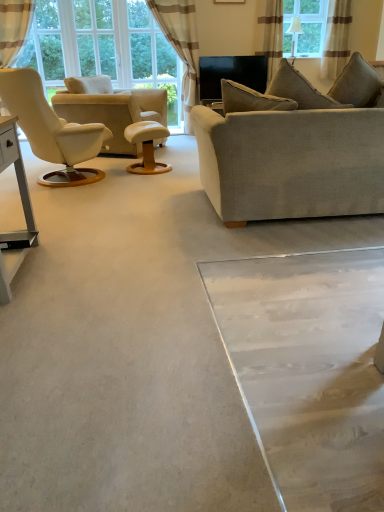
Question: Is beige leather chair at left completely or partially outside of transparent glass door at upper center?

Choices:
 (A) no
 (B) yes

Answer: (B)

Question: Does beige leather chair at left have a greater height compared to transparent glass door at upper center?

Choices:
 (A) no
 (B) yes

Answer: (A)

Question: Is beige leather chair at left looking in the opposite direction of transparent glass door at upper center?

Choices:
 (A) yes
 (B) no

Answer: (B)

Question: Is beige leather chair at left touching transparent glass door at upper center?

Choices:
 (A) no
 (B) yes

Answer: (A)

Question: Does beige leather chair at left have a smaller size compared to transparent glass door at upper center?

Choices:
 (A) yes
 (B) no

Answer: (B)

Question: Is transparent glass door at upper center a part of beige leather chair at left?

Choices:
 (A) yes
 (B) no

Answer: (B)

Question: From the image's perspective, is clear glass window at upper center below beige leather chair at left?

Choices:
 (A) yes
 (B) no

Answer: (B)

Question: Is clear glass window at upper center outside of beige leather chair at left?

Choices:
 (A) no
 (B) yes

Answer: (B)

Question: Is clear glass window at upper center at the right side of beige leather chair at left?

Choices:
 (A) yes
 (B) no

Answer: (A)

Question: Does clear glass window at upper center have a greater width compared to beige leather chair at left?

Choices:
 (A) no
 (B) yes

Answer: (A)

Question: Can you confirm if clear glass window at upper center is shorter than beige leather chair at left?

Choices:
 (A) yes
 (B) no

Answer: (A)

Question: Can you confirm if clear glass window at upper center is taller than beige leather chair at left?

Choices:
 (A) yes
 (B) no

Answer: (B)

Question: Is the position of wooden round table at center more distant than that of beige leather chair at left?

Choices:
 (A) no
 (B) yes

Answer: (A)